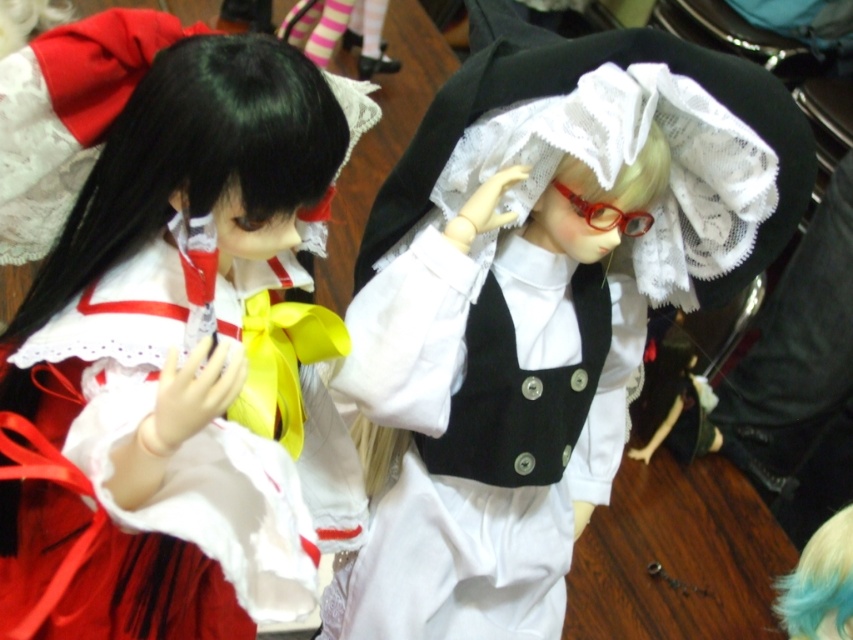
Which is in front, point (254, 444) or point (836, 634)?

Positioned in front is point (254, 444).

Can you confirm if matte white dress at center is taller than blue fabric hair at upper right?

Correct, matte white dress at center is much taller as blue fabric hair at upper right.

Between point (190, 122) and point (831, 548), which one is positioned behind?

Positioned behind is point (831, 548).

Locate an element on the screen. This screenshot has height=640, width=853. matte white dress at center is located at coordinates (163, 337).

Which of these two, white lace dress at center or blue fabric hair at upper right, stands shorter?

Standing shorter between the two is blue fabric hair at upper right.

Who is more distant from viewer, (413, 580) or (840, 525)?

The point (413, 580) is more distant.

Which is behind, point (375, 346) or point (785, 621)?

The point (375, 346) is behind.

At what (x,y) coordinates should I click in order to perform the action: click on white lace dress at center. Please return your answer as a coordinate pair (x, y). Looking at the image, I should click on (527, 342).

Does matte white dress at center lie in front of white lace dress at center?

Yes, it is in front of white lace dress at center.

Does matte white dress at center appear on the left side of white lace dress at center?

Indeed, matte white dress at center is positioned on the left side of white lace dress at center.

Describe the element at coordinates (163, 337) in the screenshot. The image size is (853, 640). I see `matte white dress at center` at that location.

Locate an element on the screen. The width and height of the screenshot is (853, 640). matte white dress at center is located at coordinates (163, 337).